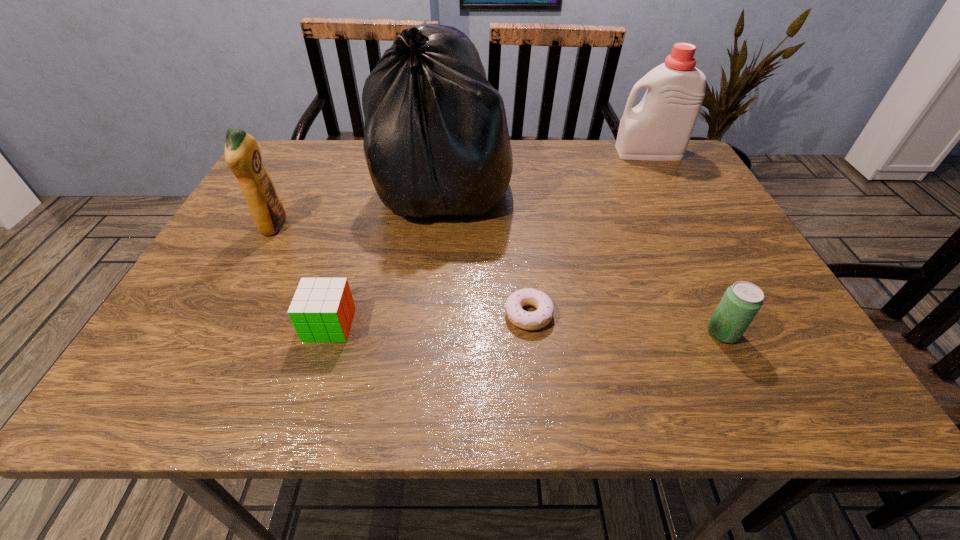
Find the location of a particular element. This screenshot has height=540, width=960. empty space that is in between the doughnut and the farther detergent is located at coordinates (588, 233).

The image size is (960, 540). I want to click on free area in between the fifth tallest object and the leftmost object, so click(301, 275).

Locate an element on the screen. Image resolution: width=960 pixels, height=540 pixels. vacant point located between the shorter detergent and the fourth tallest object is located at coordinates (498, 279).

The image size is (960, 540). Find the location of `empty space between the left detergent and the doughnut`. empty space between the left detergent and the doughnut is located at coordinates (401, 271).

The image size is (960, 540). In order to click on vacant space that's between the second shortest object and the plastic bag in this screenshot , I will do `click(387, 254)`.

Locate an element on the screen. This screenshot has width=960, height=540. object that stands as the third closest to the fourth tallest object is located at coordinates pos(659,128).

Locate which object ranks third in proximity to the plastic bag. Please provide its 2D coordinates. Your answer should be formatted as a tuple, i.e. [(x, y)], where the tuple contains the x and y coordinates of a point satisfying the conditions above.

[(322, 309)]

Locate an element on the screen. The image size is (960, 540). vacant region that satisfies the following two spatial constraints: 1. on the label of the shorter detergent; 2. on the left side of the doughnut is located at coordinates (227, 315).

I want to click on vacant space that satisfies the following two spatial constraints: 1. on the label of the leftmost object; 2. on the left side of the soda, so click(217, 333).

Find the location of a particular element. This screenshot has height=540, width=960. free space that satisfies the following two spatial constraints: 1. on the label of the leftmost object; 2. on the back side of the third shortest object is located at coordinates (217, 333).